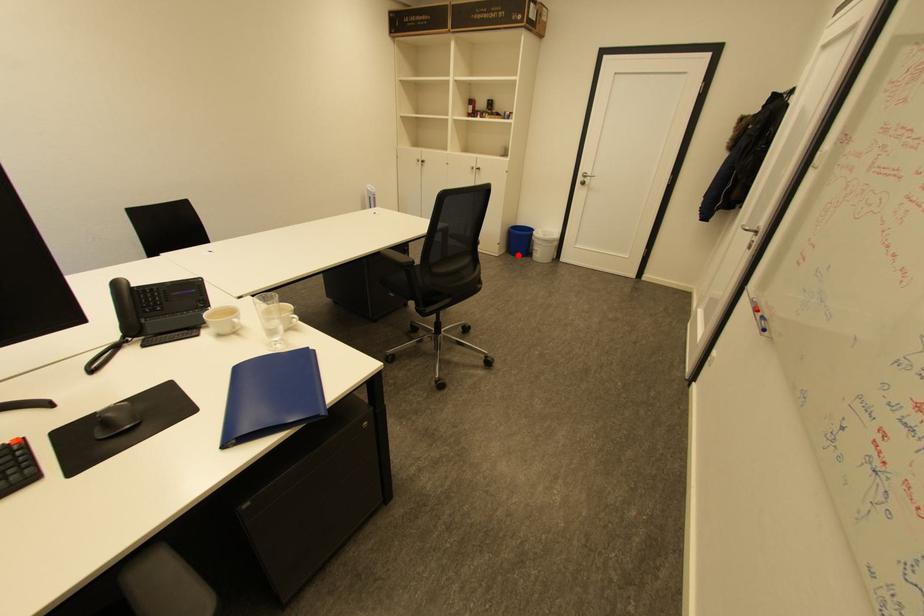
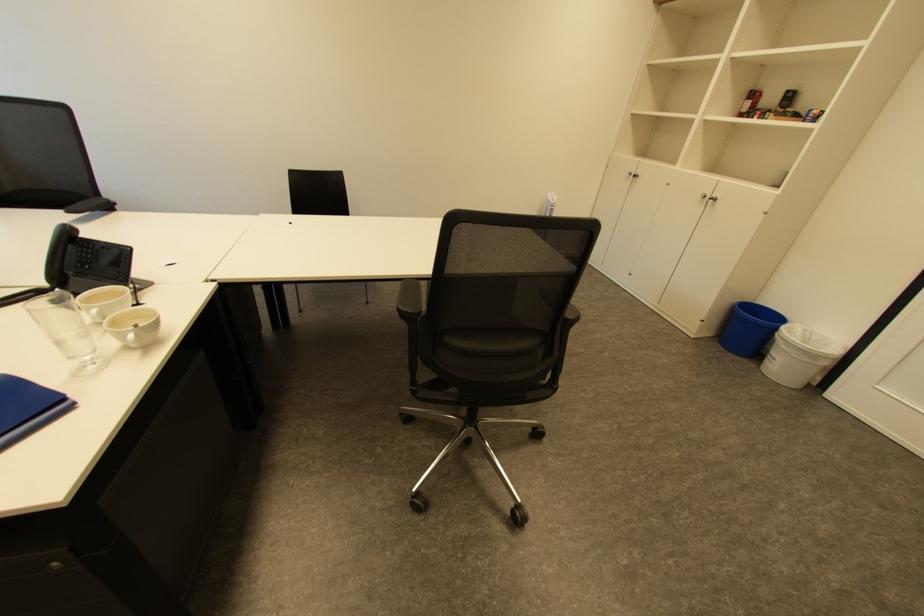
Where in the second image is the point corresponding to the highlighted location from the first image?

(728, 346)